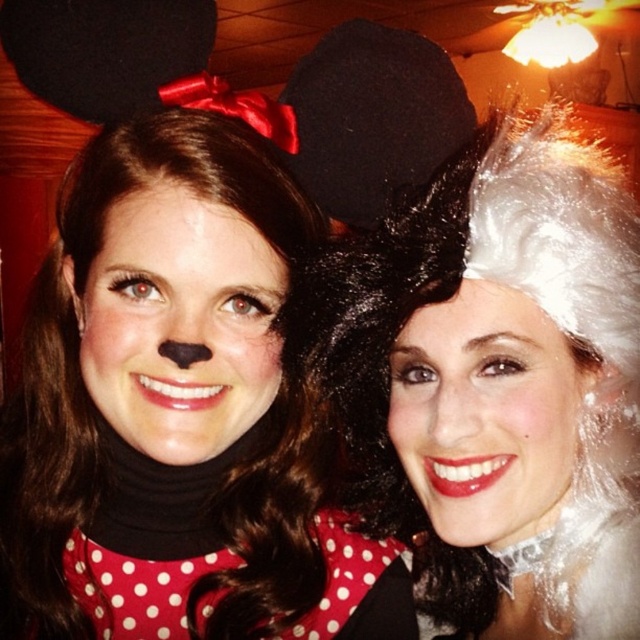
Question: Can you confirm if matte black mouse ears at left is positioned above white shiny wig at upper right?

Choices:
 (A) yes
 (B) no

Answer: (B)

Question: Is matte black mouse ears at left below white shiny wig at upper right?

Choices:
 (A) no
 (B) yes

Answer: (B)

Question: Is matte black mouse ears at left positioned behind white shiny wig at upper right?

Choices:
 (A) no
 (B) yes

Answer: (B)

Question: Which point is farther to the camera?

Choices:
 (A) (563, 205)
 (B) (241, 524)

Answer: (B)

Question: Among these objects, which one is nearest to the camera?

Choices:
 (A) white shiny wig at upper right
 (B) matte black mouse ears at left

Answer: (A)